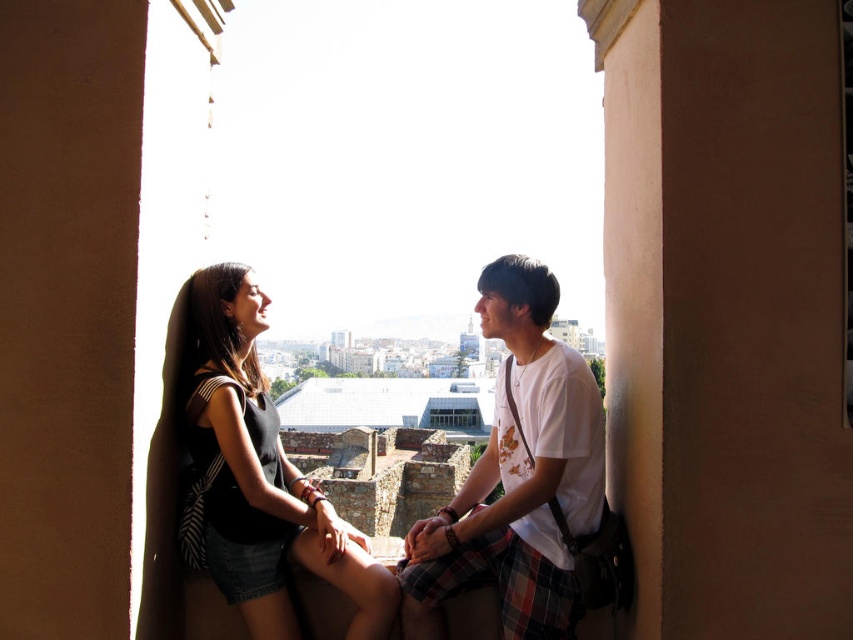
Is smooth beige wall at right thinner than white cotton shirt at center?

Indeed, smooth beige wall at right has a lesser width compared to white cotton shirt at center.

Which is above, smooth beige wall at right or white cotton shirt at center?

smooth beige wall at right is above.

At what (x,y) coordinates should I click in order to perform the action: click on smooth beige wall at right. Please return your answer as a coordinate pair (x, y). Looking at the image, I should click on (727, 312).

The height and width of the screenshot is (640, 853). I want to click on smooth beige wall at right, so click(x=727, y=312).

Where is `white cotton shirt at center`? white cotton shirt at center is located at coordinates (517, 476).

Is white cotton shirt at center to the left of black matte tank top at center from the viewer's perspective?

No, white cotton shirt at center is not to the left of black matte tank top at center.

Is point (520, 426) in front of point (281, 468)?

Yes, it is.

What are the coordinates of `white cotton shirt at center` in the screenshot? It's located at (517, 476).

What do you see at coordinates (727, 312) in the screenshot? I see `smooth beige wall at right` at bounding box center [727, 312].

Can you confirm if smooth beige wall at right is wider than black matte tank top at center?

No, smooth beige wall at right is not wider than black matte tank top at center.

Find the location of `smooth beige wall at right`. smooth beige wall at right is located at coordinates [727, 312].

Where is `smooth beige wall at right`? Image resolution: width=853 pixels, height=640 pixels. smooth beige wall at right is located at coordinates (727, 312).